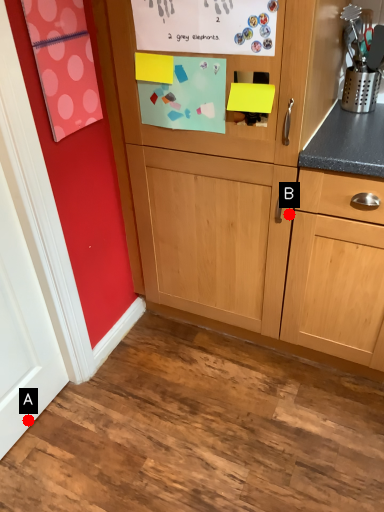
Question: Two points are circled on the image, labeled by A and B beside each circle. Which point appears farthest from the camera in this image?

Choices:
 (A) A is further
 (B) B is further

Answer: (A)